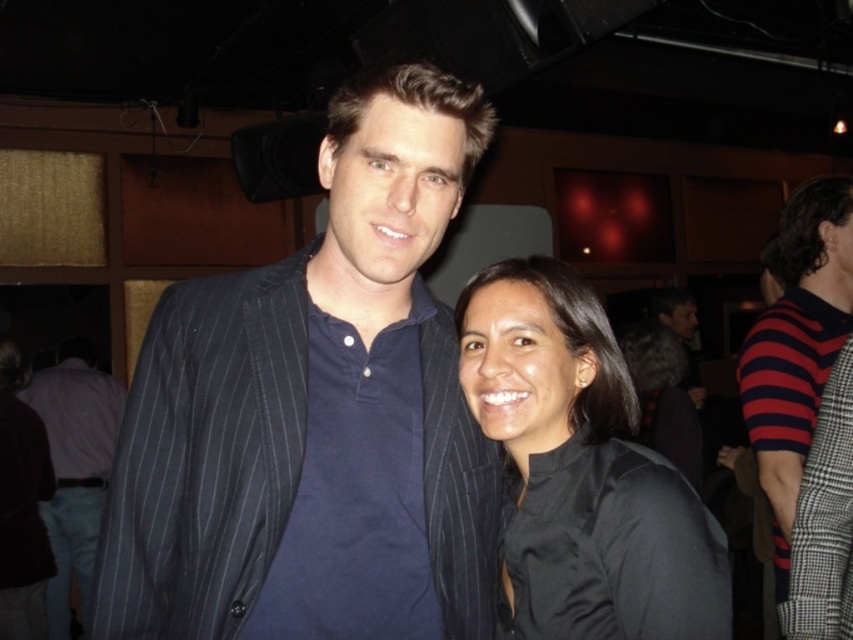
You are a photographer at a social event and need to capture a photo of the two people at the point marked as point (486, 577). The minimum distance required between subjects for a clear shot is 3 feet. Can you take a clear photo of them?

The two people at the point marked as point (486, 577) are 3.33 feet apart, which is more than the required 3 feet. Therefore, you can take a clear photo of them.

You are a photographer standing at the entrance of the venue and want to take a photo of both the black matte shirt at center and the light blue cotton shirt at center. The minimum distance between the two subjects for a clear shot is 12 feet. Can you capture both in the same frame without them overlapping?

The black matte shirt at center is 10.80 feet away from the light blue cotton shirt at center, which is less than the required 12 feet. Therefore, you cannot capture both in the same frame without them overlapping.

You are a photographer at a social event and need to capture a clear photo of both the dark blue pinstripe suit at center and the black matte shirt at center. Considering their heights, which one might appear more prominently in the photo if you position the camera at eye level?

The dark blue pinstripe suit at center is much taller than the black matte shirt at center, so it will appear more prominently in the photo when the camera is positioned at eye level.